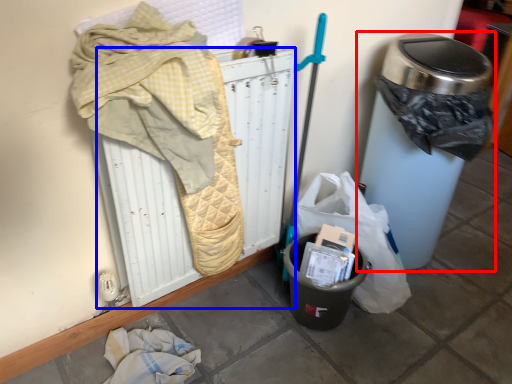
Question: Which object is closer to the camera taking this photo, waste container (highlighted by a red box) or radiator (highlighted by a blue box)?

Choices:
 (A) waste container
 (B) radiator

Answer: (B)